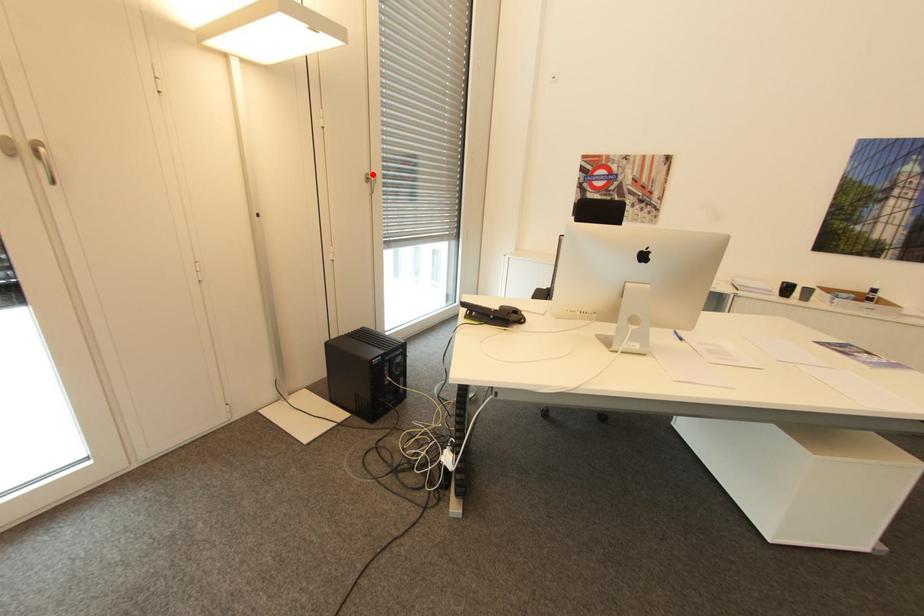
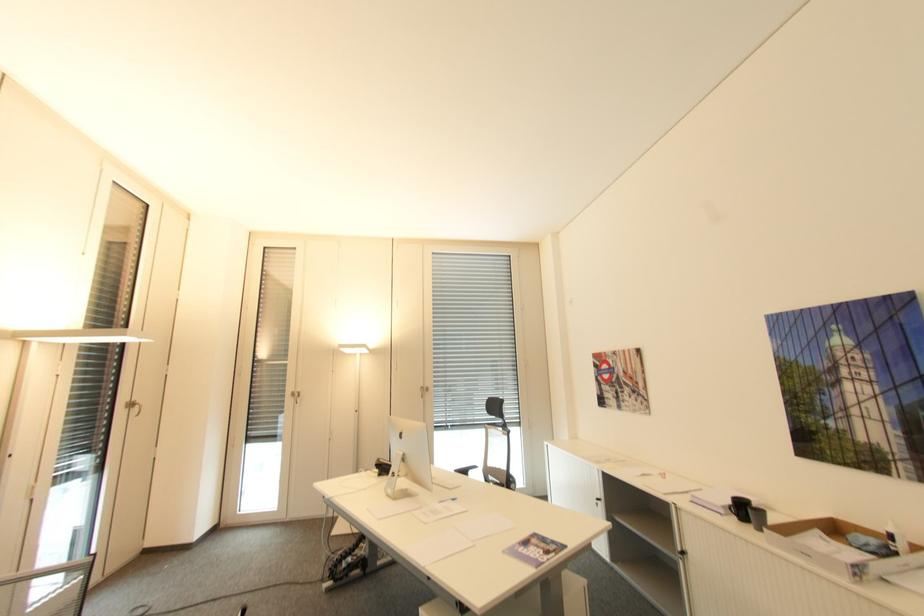
Where in the second image is the point corresponding to the highlighted location from the first image?

(427, 387)